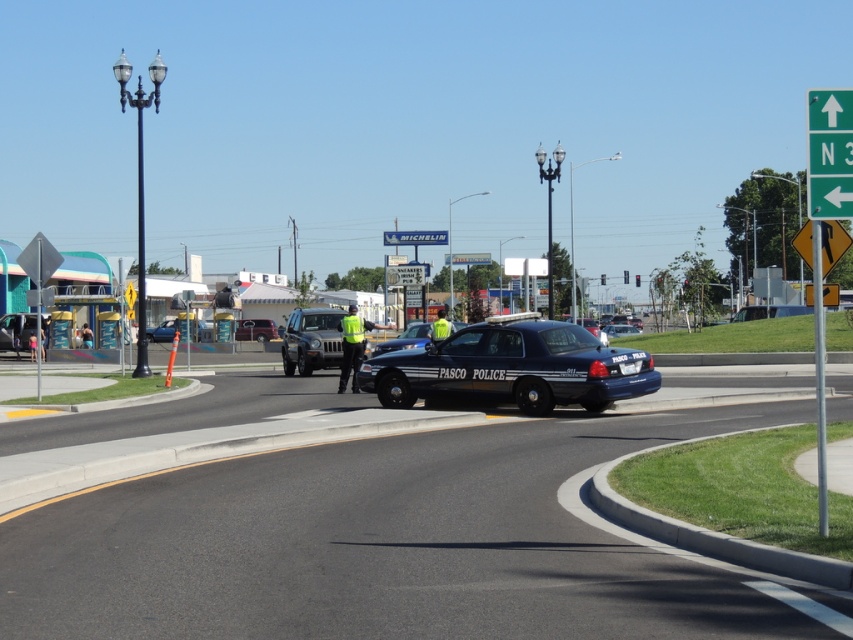
Question: Observing the image, what is the correct spatial positioning of green plastic sign at upper right in reference to matte black suv at center?

Choices:
 (A) above
 (B) below

Answer: (A)

Question: Does metallic blue sedan at center-left have a smaller size compared to glossy black sedan at center?

Choices:
 (A) no
 (B) yes

Answer: (A)

Question: Which object is closer to the camera taking this photo?

Choices:
 (A) green plastic sign at upper right
 (B) metallic silver car at left
 (C) metallic blue sedan at center-left

Answer: (A)

Question: Does metallic blue police car at center lie in front of high visibility yellow reflective vest at center?

Choices:
 (A) no
 (B) yes

Answer: (A)

Question: Which object is positioned closest to the metallic silver car at left?

Choices:
 (A) matte black suv at center
 (B) green plastic sign at upper right

Answer: (A)

Question: Which point is closer to the camera?

Choices:
 (A) metallic blue sedan at center-left
 (B) metallic silver sedan at center
 (C) metallic silver car at left
 (D) glossy black sedan at center

Answer: (A)